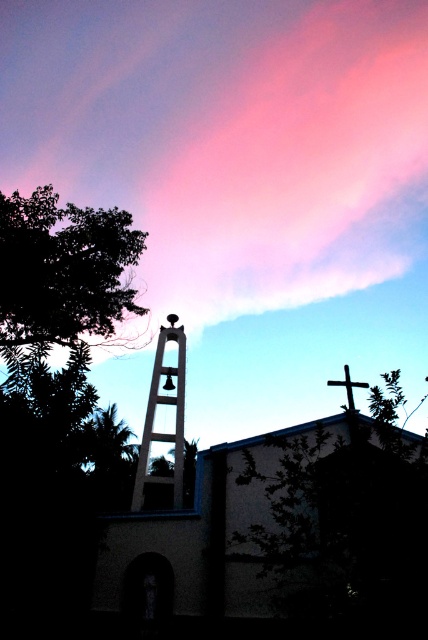
Question: Can you confirm if pink cloud at upper center is positioned to the right of metallic bell tower at center?

Choices:
 (A) no
 (B) yes

Answer: (B)

Question: Among these objects, which one is nearest to the camera?

Choices:
 (A) dark green leafy tree at left
 (B) pink cloud at upper center
 (C) metallic cross at upper center

Answer: (A)

Question: Can you confirm if dark green leafy tree at left is bigger than metallic bell tower at center?

Choices:
 (A) yes
 (B) no

Answer: (A)

Question: Does pink cloud at upper center appear on the right side of metallic cross at upper center?

Choices:
 (A) no
 (B) yes

Answer: (A)

Question: Which point appears closest to the camera in this image?

Choices:
 (A) (58, 278)
 (B) (291, 212)

Answer: (A)

Question: Which of these objects is positioned closest to the metallic bell tower at center?

Choices:
 (A) dark green leafy tree at left
 (B) metallic cross at upper center

Answer: (A)